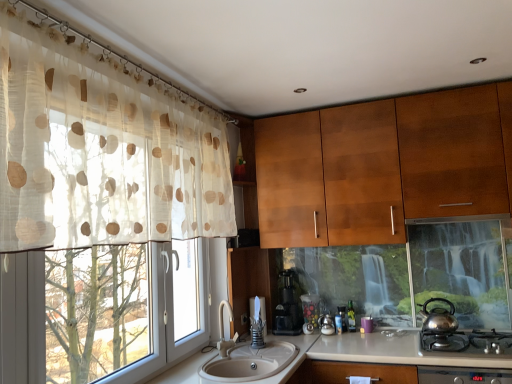
Question: Is black plastic coffee machine at center wider or thinner than shiny metallic teapot at right?

Choices:
 (A) thin
 (B) wide

Answer: (B)

Question: From a real-world perspective, is black plastic coffee machine at center above or below shiny metallic teapot at right?

Choices:
 (A) above
 (B) below

Answer: (A)

Question: Which is nearer to the black plastic coffee machine at center?

Choices:
 (A) shiny metallic teapot at right
 (B) wooden cabinet at upper center
 (C) translucent plastic cup at center, the 2th appliance in the left-to-right sequence
 (D) beige ceramic sink at lower center
 (E) polished stainless steel kettle at lower right

Answer: (C)

Question: Estimate the real-world distances between objects in this image. Which object is closer to the translucent plastic jar at center, the 2th appliance positioned from the right?

Choices:
 (A) polished stainless steel kettle at lower right
 (B) shiny metallic teapot at right
 (C) black plastic coffee machine at center
 (D) translucent beige polka dot curtain at left
 (E) beige ceramic sink at lower center

Answer: (C)